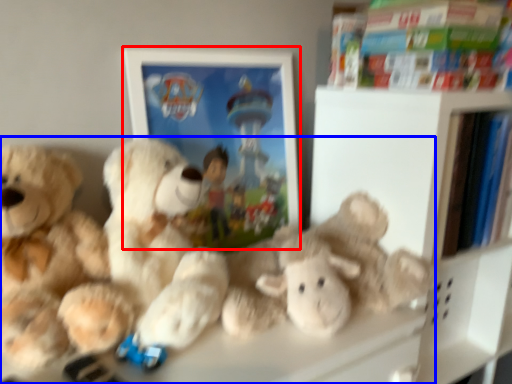
Question: Which object is further to the camera taking this photo, picture frame (highlighted by a red box) or teddy bear (highlighted by a blue box)?

Choices:
 (A) picture frame
 (B) teddy bear

Answer: (A)